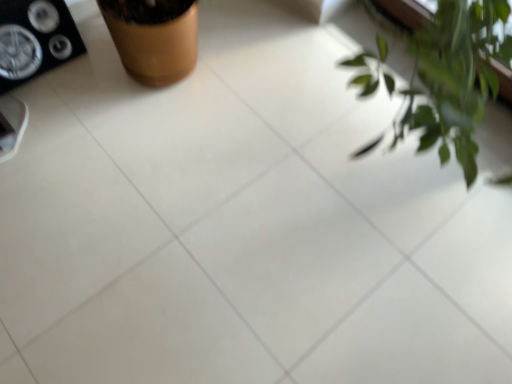
Locate an element on the screen. free point in front of metallic silver speaker at upper left is located at coordinates (38, 111).